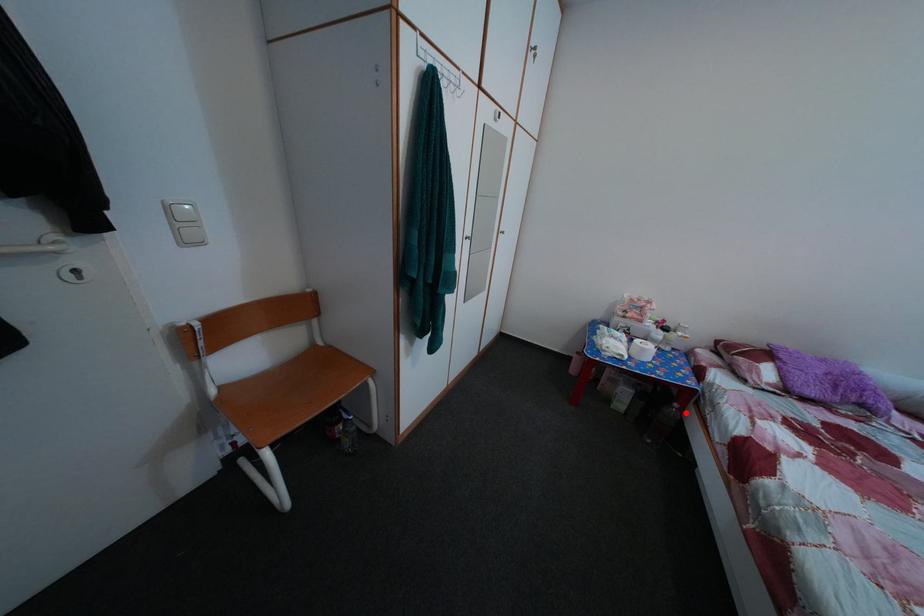
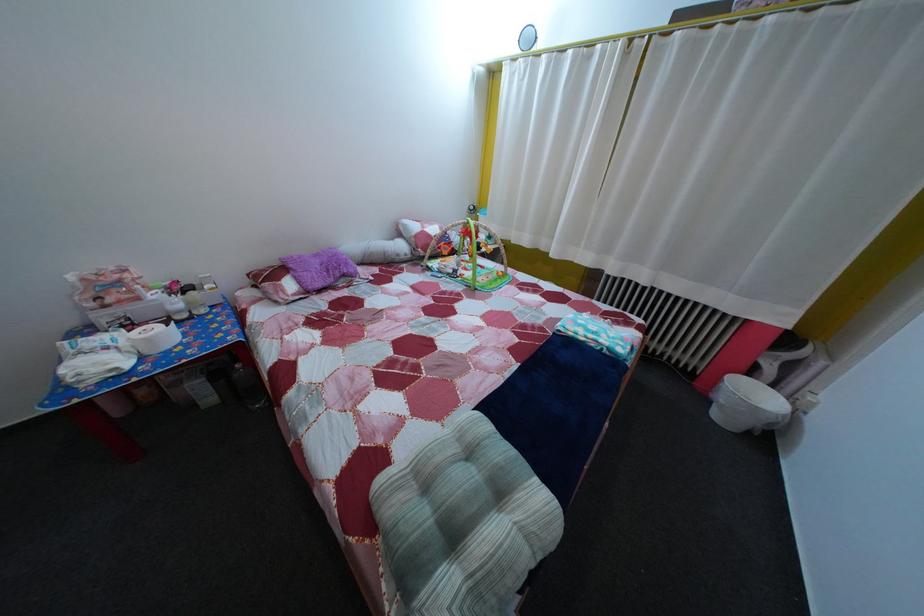
Question: A red point is marked in image1. In image2, is the corresponding 3D point closer to the camera or farther? Reply with the corresponding letter.

Choices:
 (A) The corresponding 3D point is closer.
 (B) The corresponding 3D point is farther.

Answer: (B)